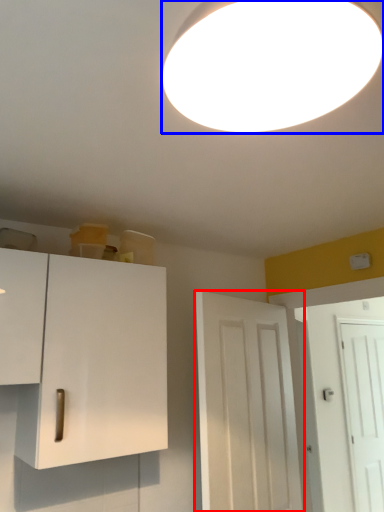
Question: Which object is closer to the camera taking this photo, door (highlighted by a red box) or lamp (highlighted by a blue box)?

Choices:
 (A) door
 (B) lamp

Answer: (B)